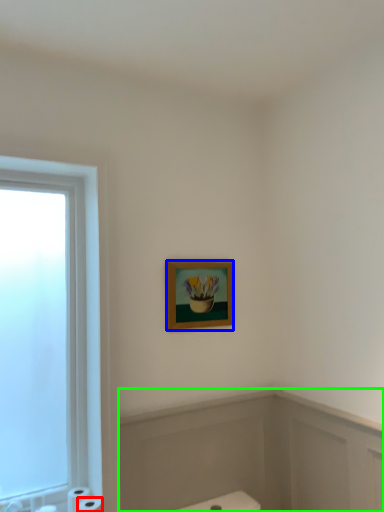
Question: Based on their relative distances, which object is nearer to toilet paper (highlighted by a red box)? Choose from picture frame (highlighted by a blue box) and bath (highlighted by a green box).

Choices:
 (A) picture frame
 (B) bath

Answer: (B)